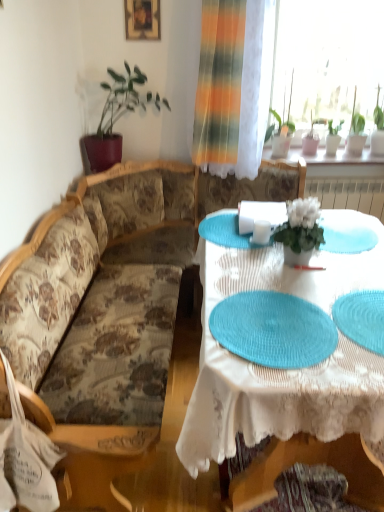
Locate an element on the screen. This screenshot has height=512, width=384. vacant space underneath teal woven placemat at center (from a real-world perspective) is located at coordinates (274, 329).